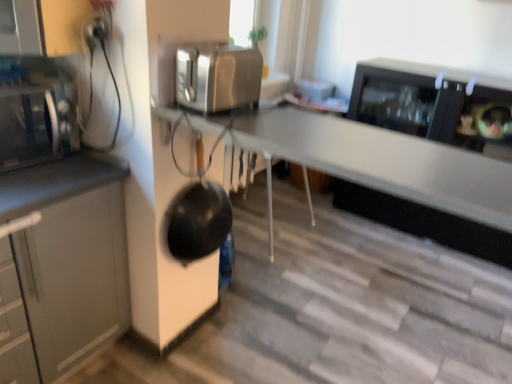
Where is `vacant space to the right of satin silver toaster at upper center`? vacant space to the right of satin silver toaster at upper center is located at coordinates (296, 122).